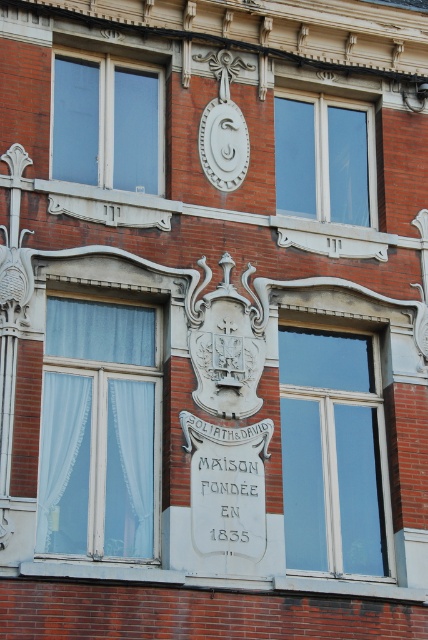
Question: Which point is farther to the camera?

Choices:
 (A) clear glass window at center
 (B) transparent glass window at upper left

Answer: (A)

Question: Which object is closer to the camera taking this photo?

Choices:
 (A) clear glass window at upper center
 (B) transparent glass window at upper left
 (C) clear glass window at center
 (D) white stone plaque at center

Answer: (D)

Question: Estimate the real-world distances between objects in this image. Which object is closer to the clear glass window at center?

Choices:
 (A) white matte clock at upper center
 (B) white sheer curtains at left
 (C) clear glass window at upper center

Answer: (C)

Question: Does white sheer curtains at left have a larger size compared to clear glass window at center?

Choices:
 (A) no
 (B) yes

Answer: (B)

Question: Is clear glass window at center wider than clear glass window at upper center?

Choices:
 (A) no
 (B) yes

Answer: (A)

Question: Where is white sheer curtains at left located in relation to transparent glass window at upper left in the image?

Choices:
 (A) above
 (B) below

Answer: (B)